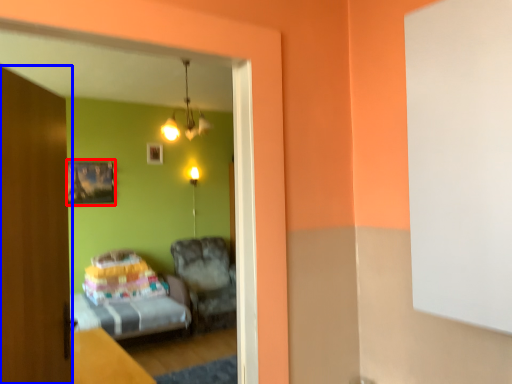
Question: Which object is closer to the camera taking this photo, picture frame (highlighted by a red box) or door (highlighted by a blue box)?

Choices:
 (A) picture frame
 (B) door

Answer: (B)